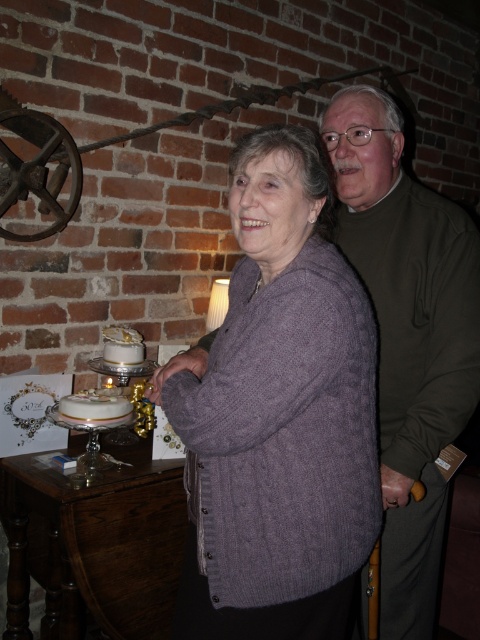
Can you confirm if purple knitted sweater at center is thinner than brown wooden table at lower left?

Yes.

Can you confirm if purple knitted sweater at center is bigger than brown wooden table at lower left?

Actually, purple knitted sweater at center might be smaller than brown wooden table at lower left.

Is point (206, 388) positioned after point (113, 577)?

No, it is not.

At what (x,y) coordinates should I click in order to perform the action: click on purple knitted sweater at center. Please return your answer as a coordinate pair (x, y). The height and width of the screenshot is (640, 480). Looking at the image, I should click on point(280,413).

Does point (432, 541) lie in front of point (58, 410)?

Yes.

Who is more distant from viewer, [356,140] or [94,412]?

The point [94,412] is more distant.

The height and width of the screenshot is (640, 480). I want to click on green matte sweater at upper right, so click(x=408, y=337).

Which is below, green matte sweater at upper right or brown wooden table at lower left?

brown wooden table at lower left is lower down.

Is green matte sweater at upper right wider than brown wooden table at lower left?

Incorrect, green matte sweater at upper right's width does not surpass brown wooden table at lower left's.

Is point (409, 570) farther from camera compared to point (81, 516)?

No, (409, 570) is in front of (81, 516).

The height and width of the screenshot is (640, 480). What are the coordinates of `green matte sweater at upper right` in the screenshot? It's located at (408, 337).